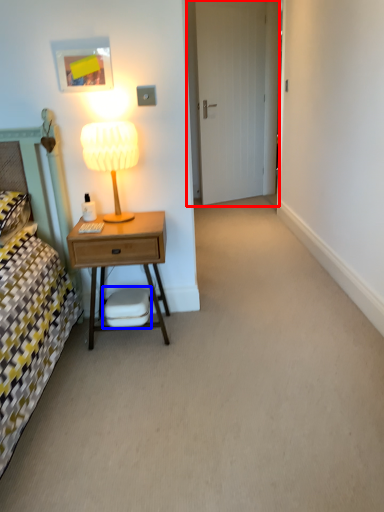
Question: Which object appears farthest to the camera in this image, door (highlighted by a red box) or swivel chair (highlighted by a blue box)?

Choices:
 (A) door
 (B) swivel chair

Answer: (A)